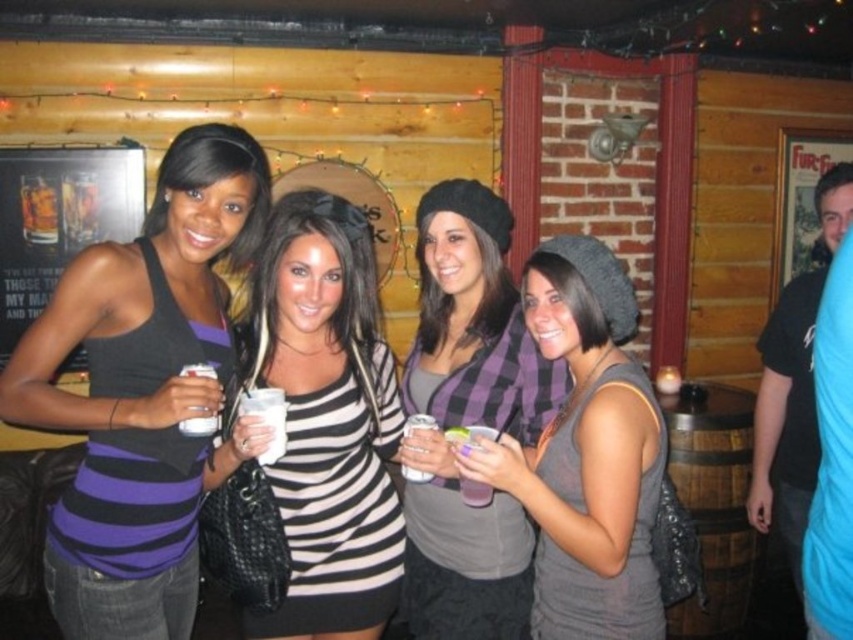
You are a photographer at the event and need to adjust the lighting. You notice the purple striped tank top at center and the clear plastic cup at center. Which object is positioned to the left of the other?

The purple striped tank top at center is to the left of the clear plastic cup at center.

In the scene shown: You are standing in the bar and want to take a photo of the black and white striped shirt at center. According to the coordinates provided, where should you aim your camera to capture it?

You should aim your camera at the coordinates point (x=326, y=419) to capture the black and white striped shirt at center.

You are at the bar and want to place both the gray matte beanie at center and the clear plastic cup at center on a shelf. The shelf can only hold items that are no wider than 12 inches. Can you fit both items on the shelf without overlapping?

The gray matte beanie at center might be wider than clear plastic cup at center. Since the shelf can only hold items no wider than 12 inches, you need to check their widths. If the beanie is wider than 12 inches, it won